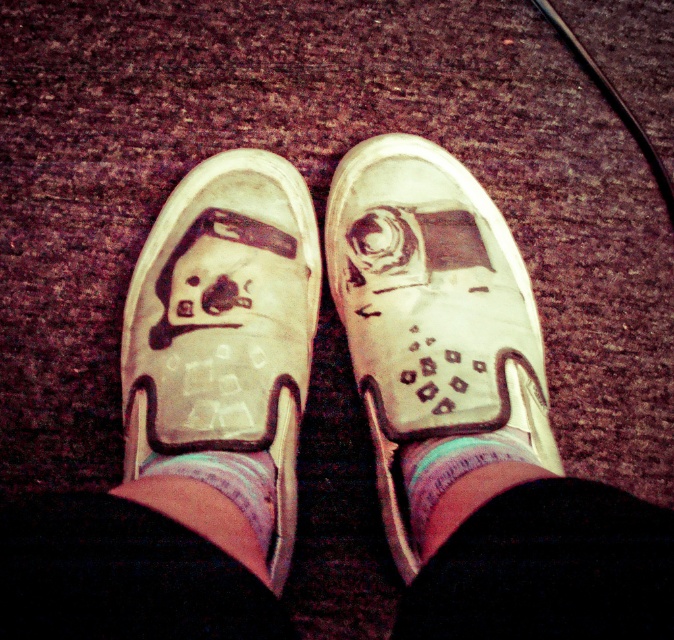
You are standing 30 inches away from the textured background. You want to take a photo of the white suede shoe at center. Can you step forward to get a closer shot without moving the shoe?

The white suede shoe at center is 28.88 inches away from viewer. Since you are currently 30 inches away from the background, stepping forward would bring you closer to the shoe, but you need to ensure you don not exceed the 28.88 inches distance to maintain focus. However, moving closer than that might cause you to be too near, potentially obstructing the shot. It is advisable to position yourself exactly at 28.88 inches for optimal results.